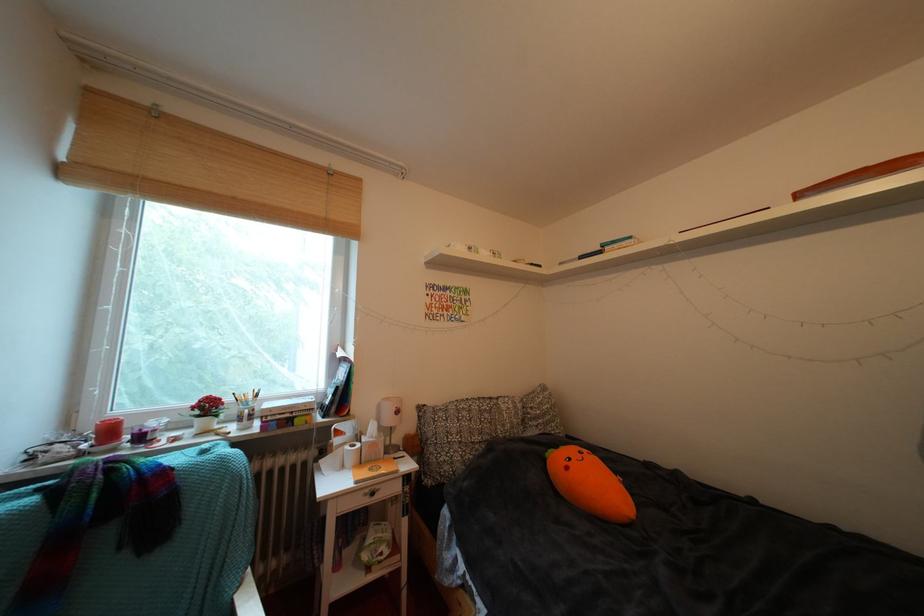
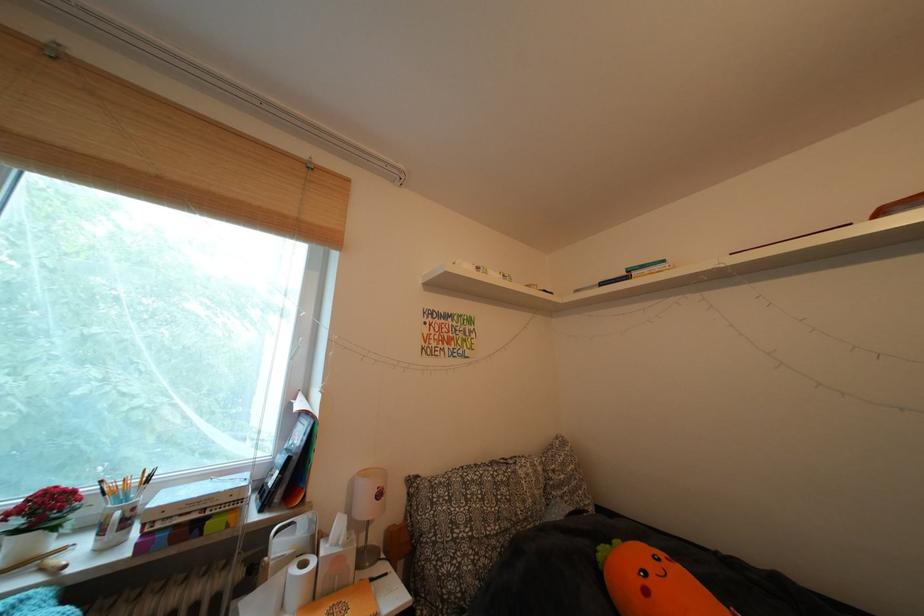
Question: How did the camera likely rotate?

Choices:
 (A) Left
 (B) Right
 (C) Up
 (D) Down

Answer: (C)